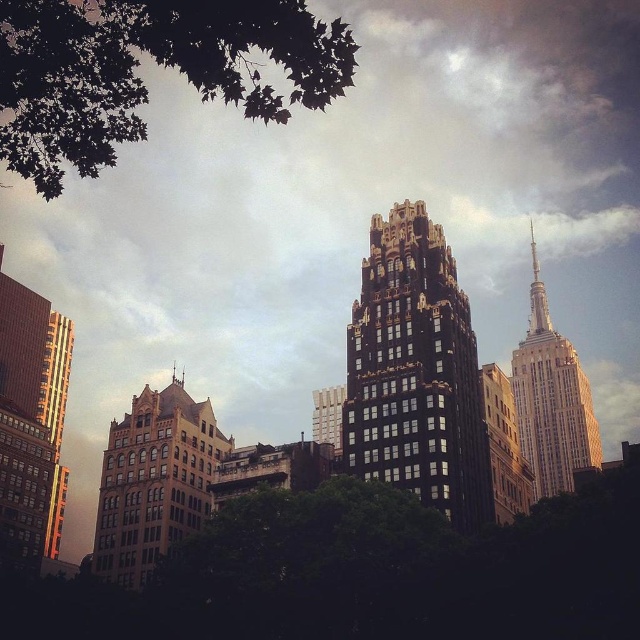
Question: Among these objects, which one is nearest to the camera?

Choices:
 (A) green leafy tree at upper left
 (B) matte brown building at lower left
 (C) green leafy tree at center
 (D) white marble tower at upper right

Answer: (A)

Question: Is green leafy tree at upper left to the right of matte brown building at lower left from the viewer's perspective?

Choices:
 (A) yes
 (B) no

Answer: (B)

Question: Which of the following is the closest to the observer?

Choices:
 (A) (532, 408)
 (B) (209, 442)
 (C) (324, 433)
 (D) (83, 72)

Answer: (D)

Question: Is gold reflective glass skyscraper at left thinner than brick textured building at center?

Choices:
 (A) yes
 (B) no

Answer: (B)

Question: Which object is the farthest from the green leafy tree at upper left?

Choices:
 (A) gold textured building at center
 (B) matte brown building at lower left

Answer: (A)

Question: Can you confirm if black textured building at center is positioned to the right of gold reflective glass skyscraper at left?

Choices:
 (A) no
 (B) yes

Answer: (B)